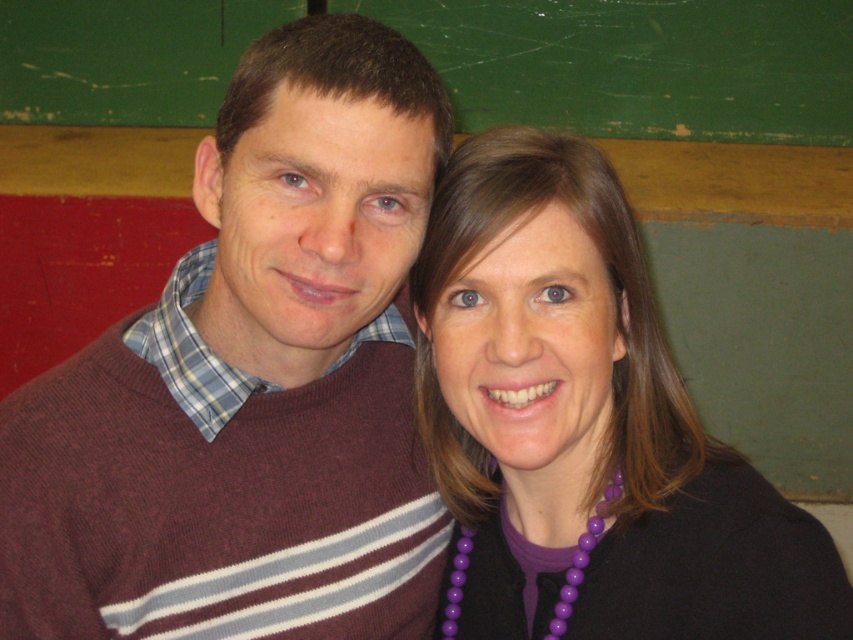
You are a photographer adjusting your camera to focus on the maroon sweater at center and the purple beaded necklace at upper right. Which object should you focus on first to ensure both are in focus?

You should focus on the maroon sweater at center first because it is closer to the viewer than the purple beaded necklace at upper right, so adjusting focus starting from the closer object ensures both can be in focus.

You are an interior designer assessing the placement of two purple beaded necklaces in a room. The necklaces are labeled as the purple beaded necklace at upper right and the purple beaded necklace at lower center. Based on their sizes, which necklace would you recommend hanging in a location where a larger visual impact is desired?

The purple beaded necklace at upper right has a larger width than the purple beaded necklace at lower center, so it would be more suitable for creating a larger visual impact.

You are standing in the room and want to place a sticker exactly at the point marked by the coordinates point (251,381). Which object from the scene should you target to place the sticker there?

The point (251,381) is on the maroon sweater at center, so you should place the sticker on the maroon sweater at center.